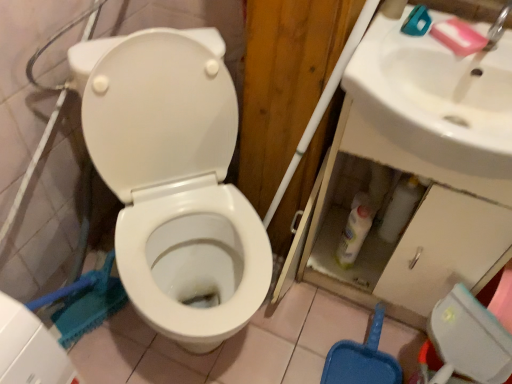
Question: Is white glossy toilet at center outside of white glossy sink at upper right?

Choices:
 (A) yes
 (B) no

Answer: (A)

Question: Considering the relative sizes of white glossy toilet at center and white glossy sink at upper right in the image provided, is white glossy toilet at center thinner than white glossy sink at upper right?

Choices:
 (A) yes
 (B) no

Answer: (B)

Question: Is white glossy toilet at center facing away from white glossy sink at upper right?

Choices:
 (A) yes
 (B) no

Answer: (B)

Question: From a real-world perspective, does white glossy toilet at center stand above white glossy sink at upper right?

Choices:
 (A) yes
 (B) no

Answer: (B)

Question: Can you confirm if white glossy toilet at center is wider than white glossy sink at upper right?

Choices:
 (A) no
 (B) yes

Answer: (B)

Question: Which is correct: white glossy bottle at lower center is inside white glossy sink at upper right, or outside of it?

Choices:
 (A) inside
 (B) outside

Answer: (B)

Question: In terms of width, does white glossy bottle at lower center look wider or thinner when compared to white glossy sink at upper right?

Choices:
 (A) thin
 (B) wide

Answer: (A)

Question: Is white glossy bottle at lower center bigger or smaller than white glossy sink at upper right?

Choices:
 (A) big
 (B) small

Answer: (B)

Question: From their relative heights in the image, would you say white glossy bottle at lower center is taller or shorter than white glossy sink at upper right?

Choices:
 (A) short
 (B) tall

Answer: (B)

Question: Based on their positions, is white glossy bottle at lower center located to the left or right of white glossy toilet at center?

Choices:
 (A) right
 (B) left

Answer: (A)

Question: Based on their sizes in the image, would you say white glossy bottle at lower center is bigger or smaller than white glossy toilet at center?

Choices:
 (A) big
 (B) small

Answer: (B)

Question: Looking at their shapes, would you say white glossy bottle at lower center is wider or thinner than white glossy toilet at center?

Choices:
 (A) thin
 (B) wide

Answer: (A)

Question: From a real-world perspective, relative to white glossy toilet at center, is white glossy bottle at lower center vertically above or below?

Choices:
 (A) below
 (B) above

Answer: (A)

Question: Considering the positions of pink matte soap at upper right and white glossy sink at upper right in the image, is pink matte soap at upper right taller or shorter than white glossy sink at upper right?

Choices:
 (A) short
 (B) tall

Answer: (A)

Question: From a real-world perspective, is pink matte soap at upper right physically located above or below white glossy sink at upper right?

Choices:
 (A) below
 (B) above

Answer: (B)